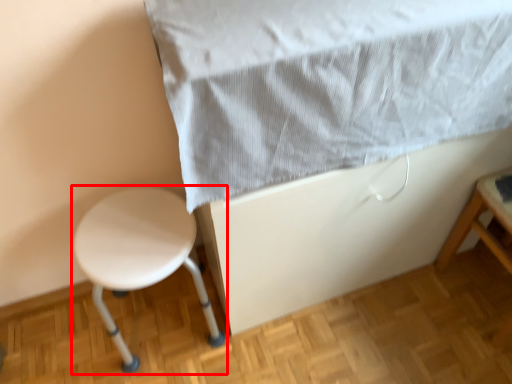
Question: From the image's perspective, where is stool (annotated by the red box) located relative to sheet?

Choices:
 (A) above
 (B) below

Answer: (B)